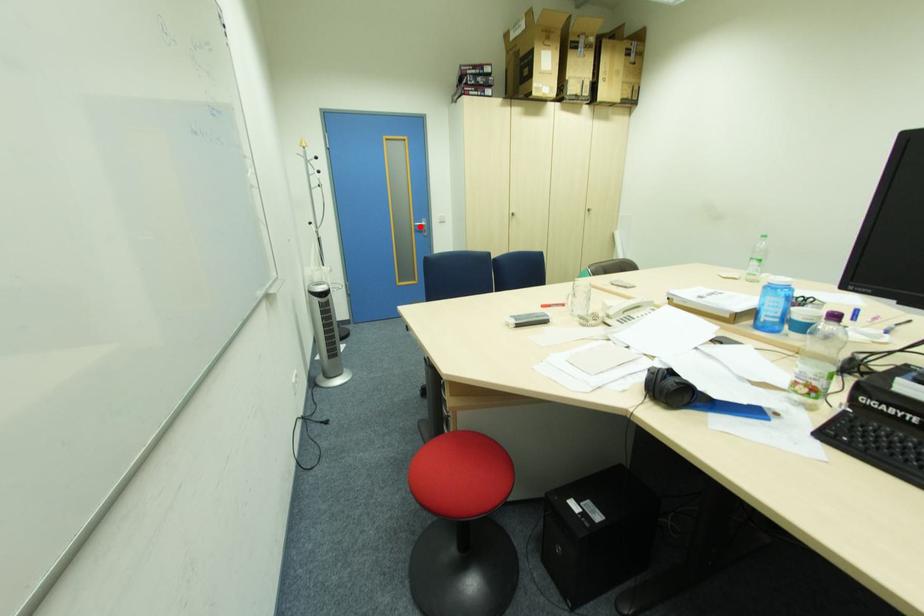
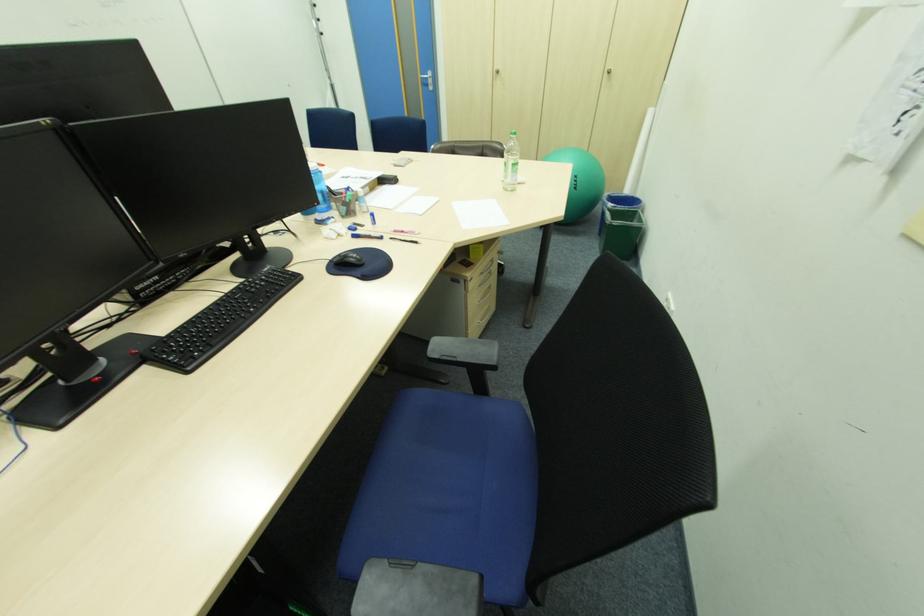
Find the pixel in the second image that matches the highlighted location in the first image.

(428, 79)